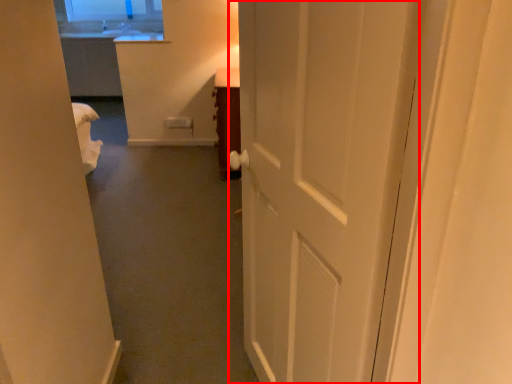
Question: From the image's perspective, considering the relative positions of door (annotated by the red box) and furniture in the image provided, where is door (annotated by the red box) located with respect to the staircase?

Choices:
 (A) below
 (B) above

Answer: (A)